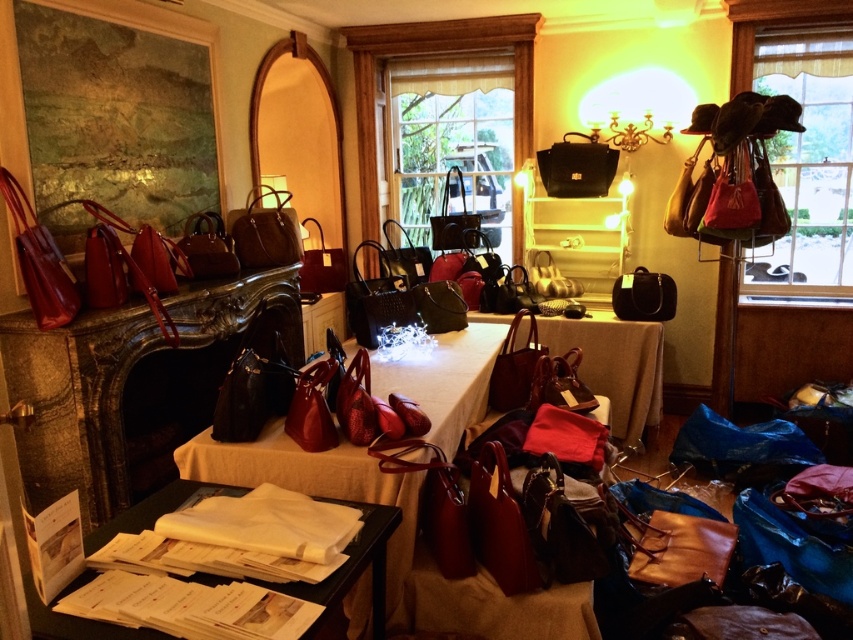
You are a customer in the store and want to pick up the shiny leather handbags at center. Which direction should you move from the matte black handbag at upper center to reach them?

You should move to the left from the matte black handbag at upper center to reach the shiny leather handbags at center since they are positioned to the left of it.